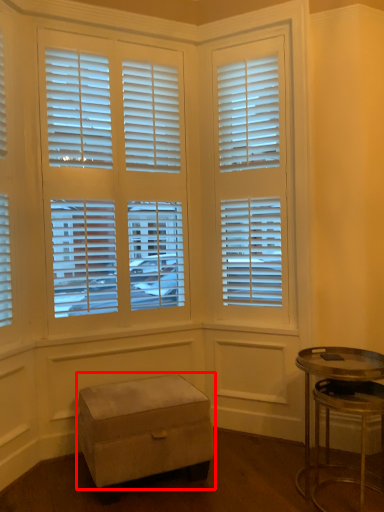
Question: From the image's perspective, where is step stool (annotated by the red box) located in relation to table in the image?

Choices:
 (A) above
 (B) below

Answer: (B)